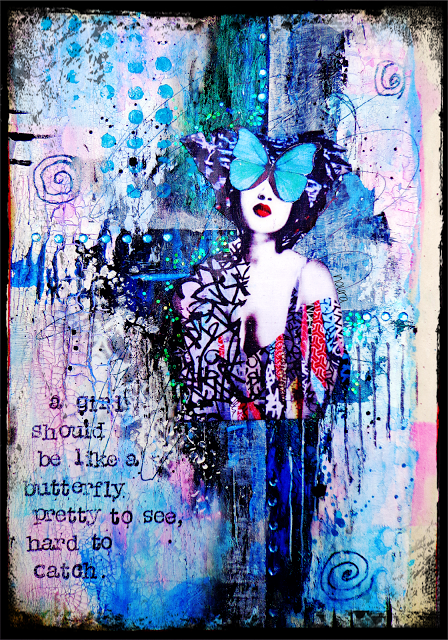
Identify the location of border of artwork. (433, 621), (12, 624), (5, 11), (433, 11), (223, 8), (4, 365), (443, 353), (222, 630).